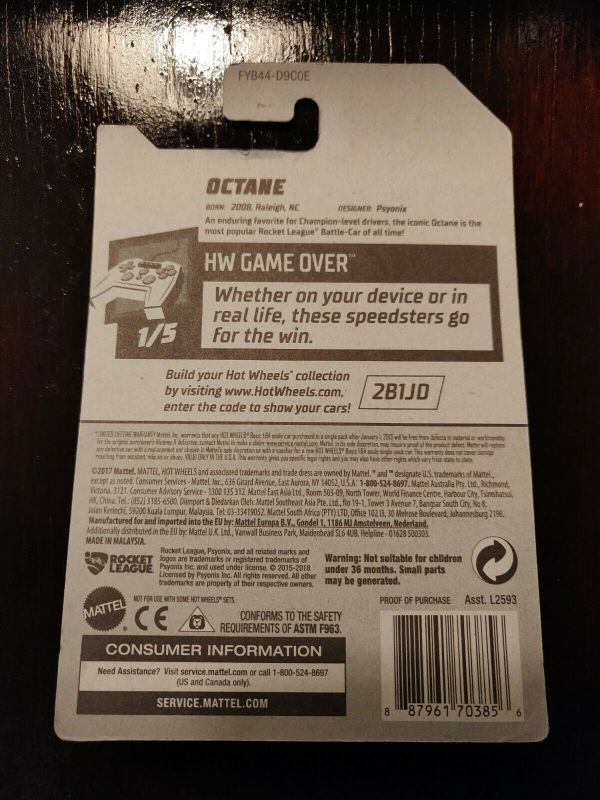
Point to any so they can hang it on a peg in the store display in the image. Your answer should be formatted as a list of tuples, i.e. [(x1, y1), (x2, y2), ...], where each tuple contains the x and y coordinates of a point satisfying the conditions above.

[(277, 132)]